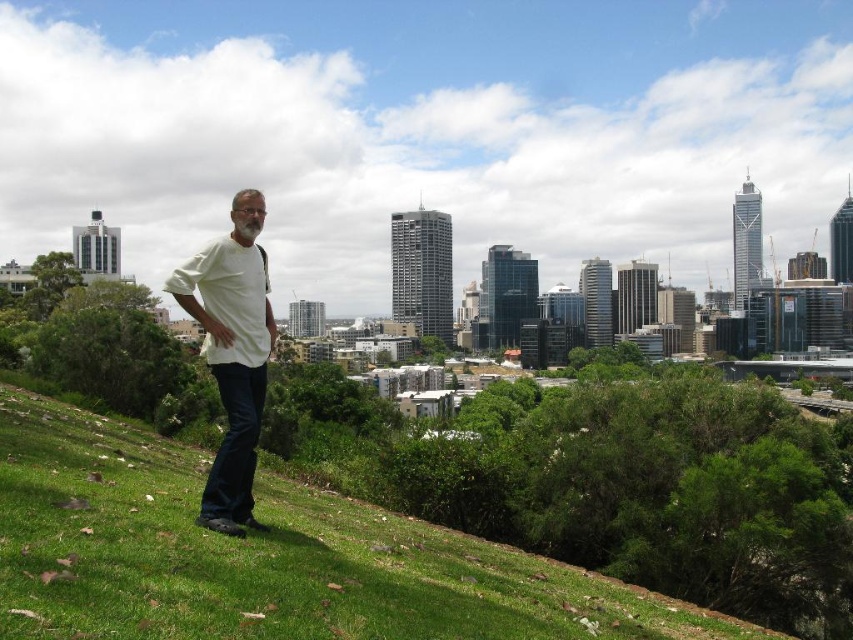
You are standing at the base of the hill and want to walk to the green grass at lower left. The path is straight and clear. If you start walking directly towards it, how far will you have to walk in meters?

The distance between the viewer and the green grass at lower left is 573.07 meters, so you will have to walk 573.07 meters to reach it.

You are a photographer trying to capture a shot of the green grass at lower left and the white matte shirt at center. Which object is shorter in the image?

The green grass at lower left is shorter than the white matte shirt at center.